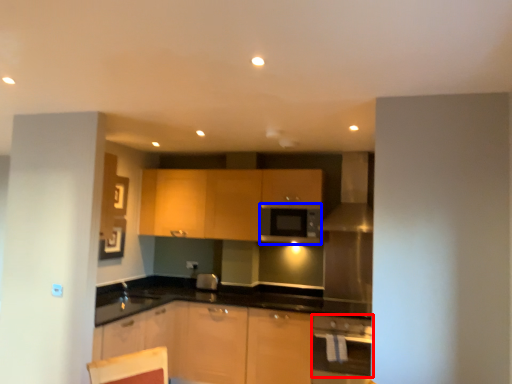
Question: Which object appears closest to the camera in this image, kitchen appliance (highlighted by a red box) or appliance (highlighted by a blue box)?

Choices:
 (A) kitchen appliance
 (B) appliance

Answer: (A)